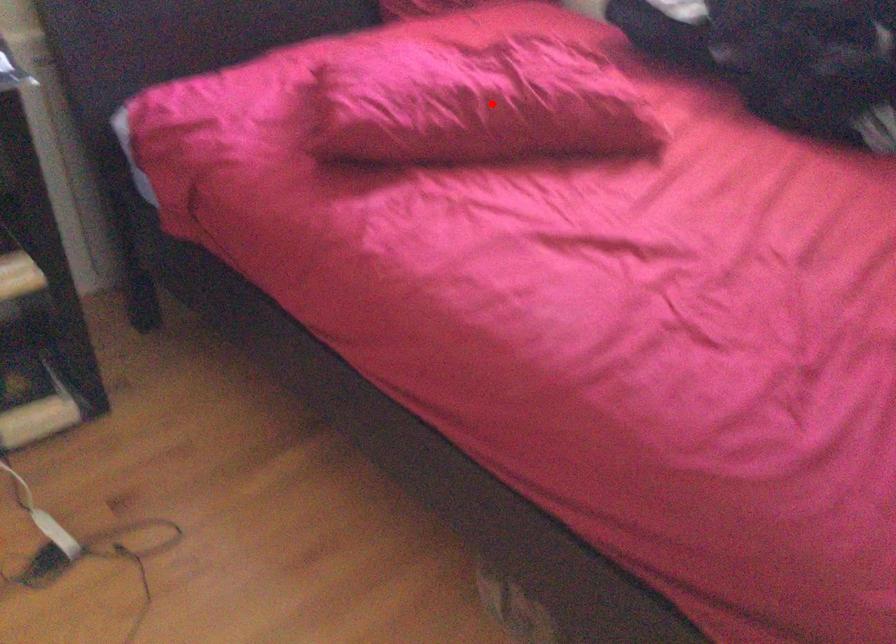
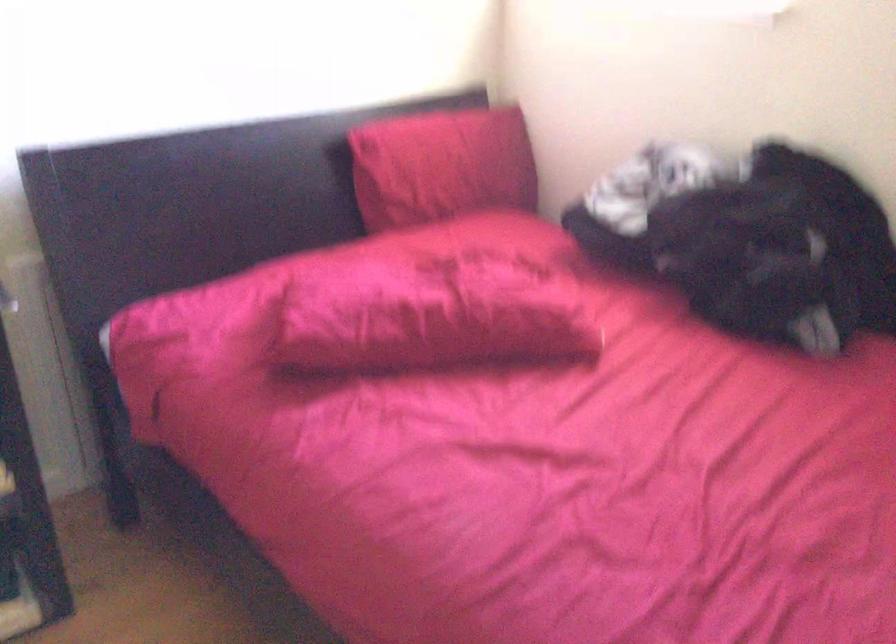
Question: I am providing you with two images of the same scene from different viewpoints. A red point is marked on the first image. Is the red point's position out of view in image 2?

Choices:
 (A) Yes
 (B) No

Answer: (B)